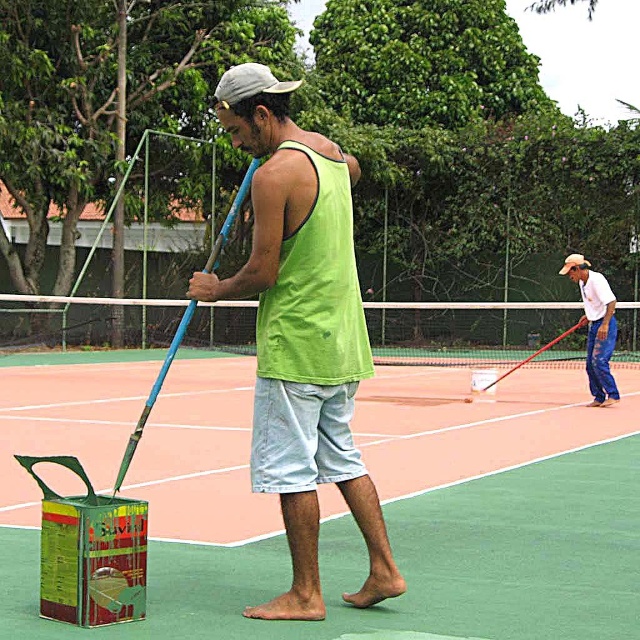
Question: Among these objects, which one is farthest from the camera?

Choices:
 (A) green fabric tank top at center
 (B) green rubber tennis court at center
 (C) light blue jeans at right

Answer: (C)

Question: Which point appears farthest from the camera in this image?

Choices:
 (A) (461, 595)
 (B) (147, 412)
 (C) (596, 282)

Answer: (C)

Question: Is green fabric tank top at center below blue wooden tennis racket at center?

Choices:
 (A) no
 (B) yes

Answer: (B)

Question: Can you confirm if green rubber tennis court at center is positioned to the right of blue wooden tennis racket at center?

Choices:
 (A) no
 (B) yes

Answer: (B)

Question: Is green fabric tank top at center below light blue jeans at right?

Choices:
 (A) no
 (B) yes

Answer: (A)

Question: Among these objects, which one is nearest to the camera?

Choices:
 (A) green rubber tennis court at center
 (B) blue wooden tennis racket at center
 (C) light blue jeans at right
 (D) green fabric tank top at center

Answer: (D)